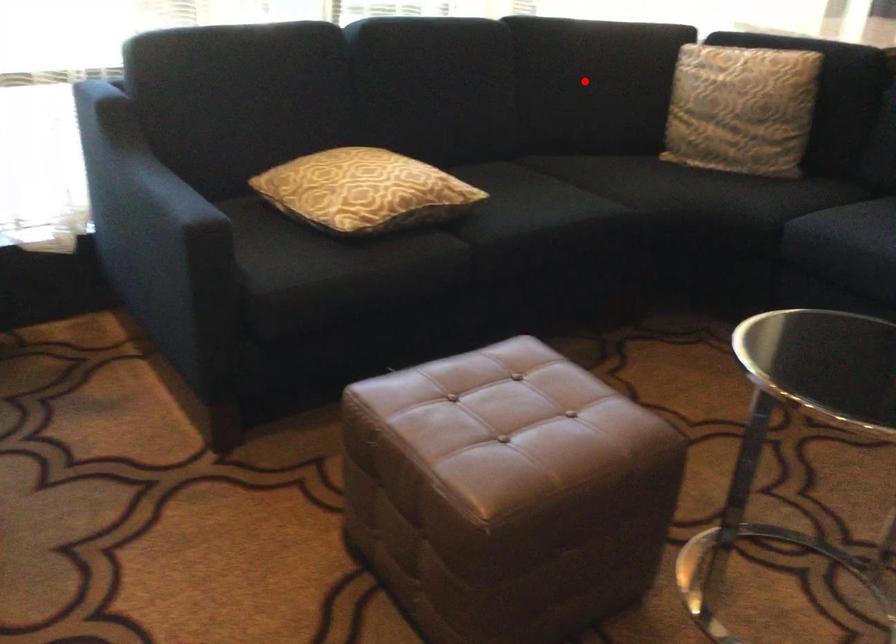
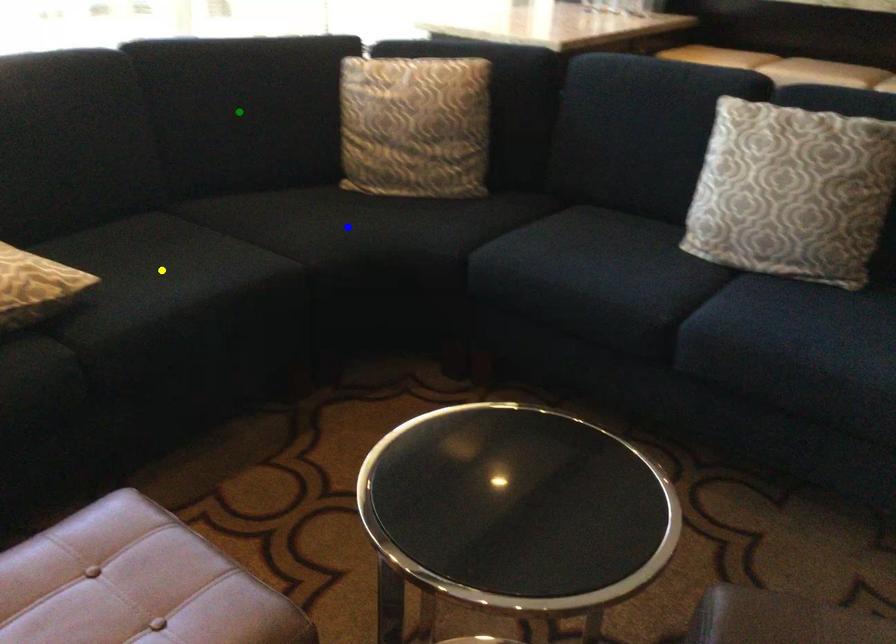
Question: I am providing you with two images of the same scene from different viewpoints. A red point is marked on the first image. You are given multiple points on the second image. Which spot in image 2 lines up with the point in image 1?

Choices:
 (A) blue point
 (B) yellow point
 (C) green point

Answer: (C)